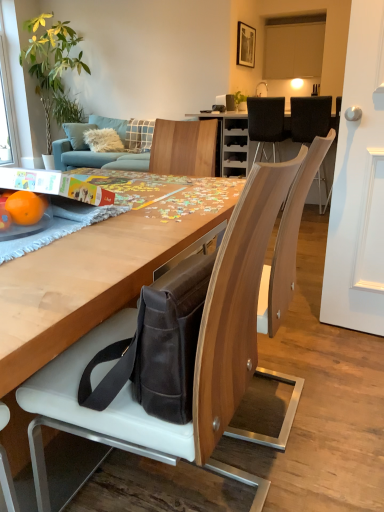
Question: From the image's perspective, is orangesmoothfruit at left over dark brown leather messenger bag at center?

Choices:
 (A) yes
 (B) no

Answer: (A)

Question: Is orangesmoothfruit at left positioned beyond the bounds of dark brown leather messenger bag at center?

Choices:
 (A) no
 (B) yes

Answer: (B)

Question: From a real-world perspective, is orangesmoothfruit at left beneath dark brown leather messenger bag at center?

Choices:
 (A) no
 (B) yes

Answer: (A)

Question: From the image's perspective, is orangesmoothfruit at left below dark brown leather messenger bag at center?

Choices:
 (A) no
 (B) yes

Answer: (A)

Question: Does orangesmoothfruit at left have a greater height compared to dark brown leather messenger bag at center?

Choices:
 (A) no
 (B) yes

Answer: (A)

Question: From the image's perspective, is black leather chair at upper right, marked as the 3th chair in a left-to-right arrangement, located above or below leather bag at lower center, the first chair in the left-to-right sequence?

Choices:
 (A) below
 (B) above

Answer: (B)

Question: Considering the positions of black leather chair at upper right, which ranks as the second chair in back-to-front order, and leather bag at lower center, the first chair in the left-to-right sequence, in the image, is black leather chair at upper right, which ranks as the second chair in back-to-front order, bigger or smaller than leather bag at lower center, the first chair in the left-to-right sequence,?

Choices:
 (A) small
 (B) big

Answer: (A)

Question: Is black leather chair at upper right, marked as the 2th chair in a top-to-bottom arrangement, inside or outside of leather bag at lower center, the first chair in the left-to-right sequence?

Choices:
 (A) outside
 (B) inside

Answer: (A)

Question: Based on their positions, is black leather chair at upper right, marked as the 2th chair in a top-to-bottom arrangement, located to the left or right of leather bag at lower center, marked as the 3th chair in a back-to-front arrangement?

Choices:
 (A) left
 (B) right

Answer: (B)

Question: Considering the positions of point (210, 278) and point (256, 152), is point (210, 278) closer or farther from the camera than point (256, 152)?

Choices:
 (A) closer
 (B) farther

Answer: (A)

Question: From the image's perspective, is leather bag at lower center, the first chair positioned from the front, above or below black leather chair at upper center, which is the second chair in left-to-right order?

Choices:
 (A) above
 (B) below

Answer: (B)

Question: Visually, is leather bag at lower center, acting as the third chair starting from the right, positioned to the left or to the right of black leather chair at upper center, acting as the third chair starting from the front?

Choices:
 (A) right
 (B) left

Answer: (B)

Question: Is leather bag at lower center, the first chair in the left-to-right sequence, bigger or smaller than black leather chair at upper center, which appears as the 2th chair when viewed from the right?

Choices:
 (A) big
 (B) small

Answer: (A)

Question: In terms of height, does transparent glass window screen at upper left look taller or shorter compared to leather bag at lower center, the first chair positioned from the front?

Choices:
 (A) short
 (B) tall

Answer: (B)

Question: In terms of size, does transparent glass window screen at upper left appear bigger or smaller than leather bag at lower center, the first chair positioned from the front?

Choices:
 (A) big
 (B) small

Answer: (B)